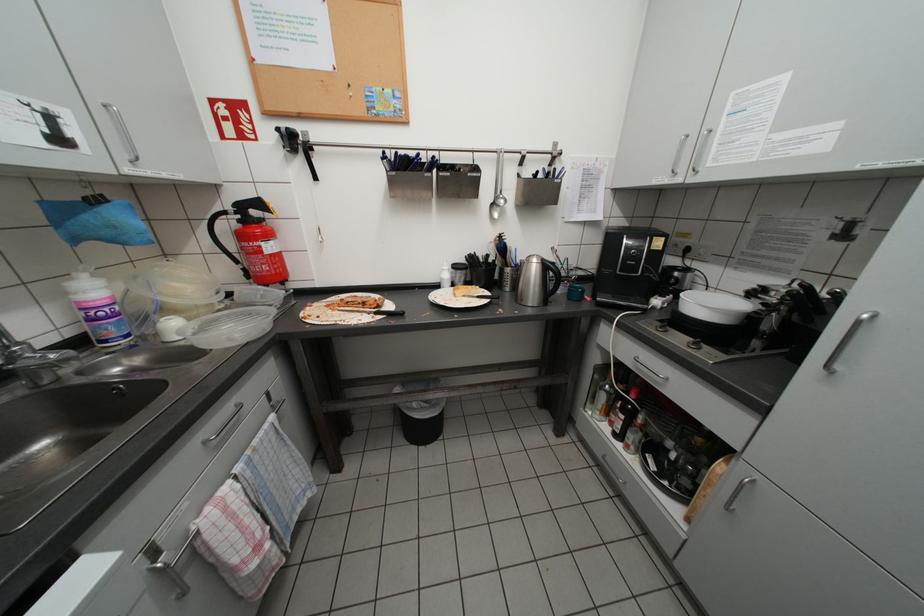
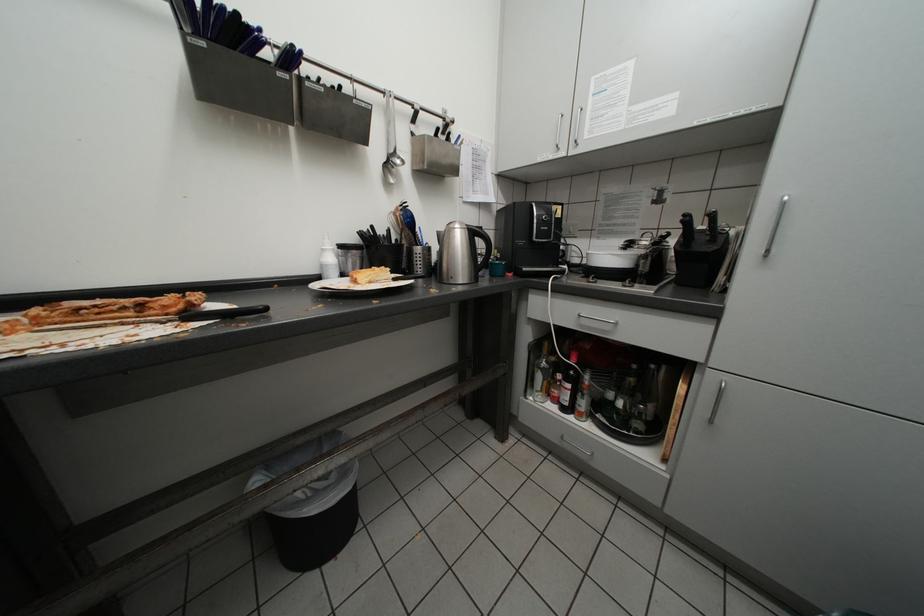
Question: The first image is from the beginning of the video and the second image is from the end. How did the camera likely rotate when shooting the video?

Choices:
 (A) Left
 (B) Right
 (C) Up
 (D) Down

Answer: (B)